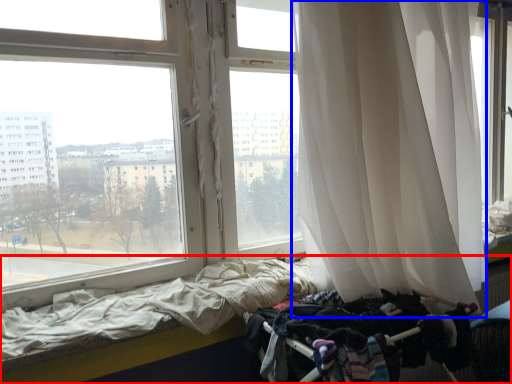
Question: Which object is closer to the camera taking this photo, bed (highlighted by a red box) or curtain (highlighted by a blue box)?

Choices:
 (A) bed
 (B) curtain

Answer: (B)